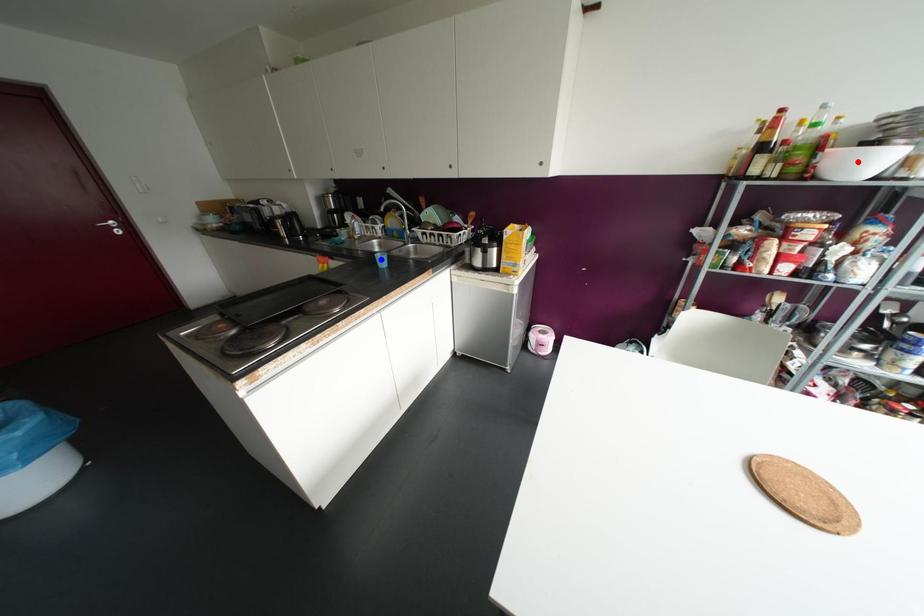
Question: Which of the two points in the image is closer to the camera?

Choices:
 (A) Blue point is closer.
 (B) Red point is closer.

Answer: (B)